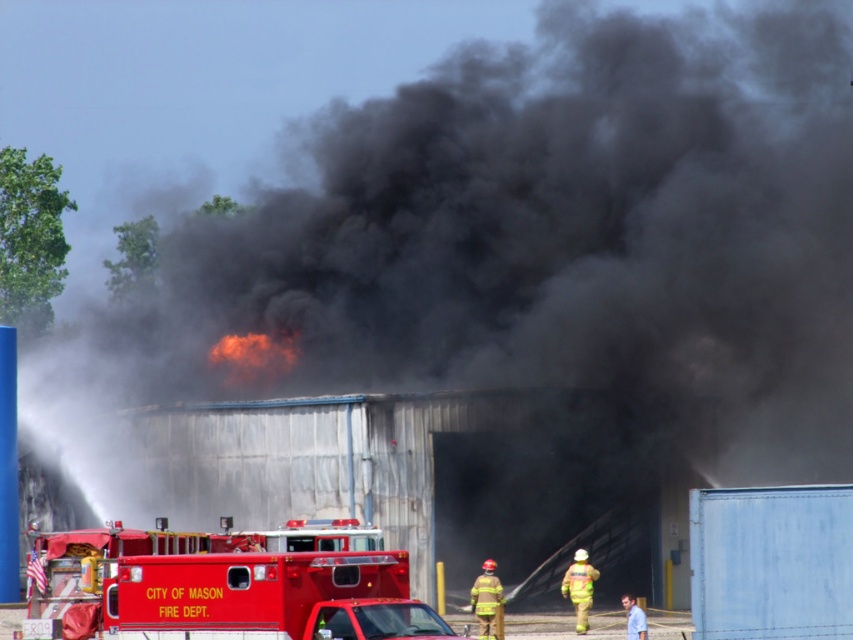
Can you confirm if shiny red fire truck at lower left is positioned to the left of red reflective helmet at lower center?

Correct, you'll find shiny red fire truck at lower left to the left of red reflective helmet at lower center.

The width and height of the screenshot is (853, 640). In order to click on shiny red fire truck at lower left in this screenshot , I will do `click(223, 586)`.

Locate an element on the screen. shiny red fire truck at lower left is located at coordinates (223, 586).

Does red reflective helmet at lower center come in front of reflective yellow fireman at lower right?

Yes, it is in front of reflective yellow fireman at lower right.

Is red reflective helmet at lower center thinner than reflective yellow fireman at lower right?

Yes.

In order to click on red reflective helmet at lower center in this screenshot , I will do `click(486, 602)`.

Identify the location of red reflective helmet at lower center. (486, 602).

Is shiny red fire truck at lower left shorter than reflective yellow fireman at lower right?

No.

Is shiny red fire truck at lower left bigger than reflective yellow fireman at lower right?

Yes.

Who is more forward, (55, 556) or (579, 561)?

Point (55, 556) is more forward.

Where is `shiny red fire truck at lower left`? The height and width of the screenshot is (640, 853). shiny red fire truck at lower left is located at coordinates (223, 586).